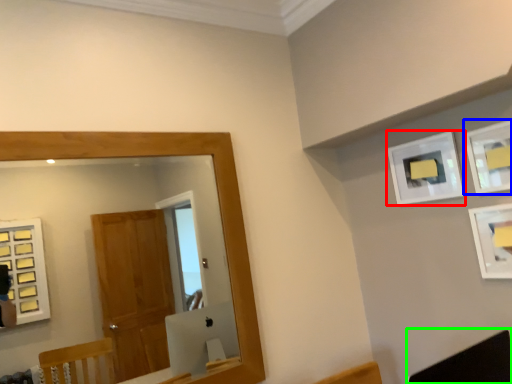
Question: Which object is positioned farthest from picture frame (highlighted by a red box)? Select from picture frame (highlighted by a blue box) and swivel chair (highlighted by a green box).

Choices:
 (A) picture frame
 (B) swivel chair

Answer: (B)